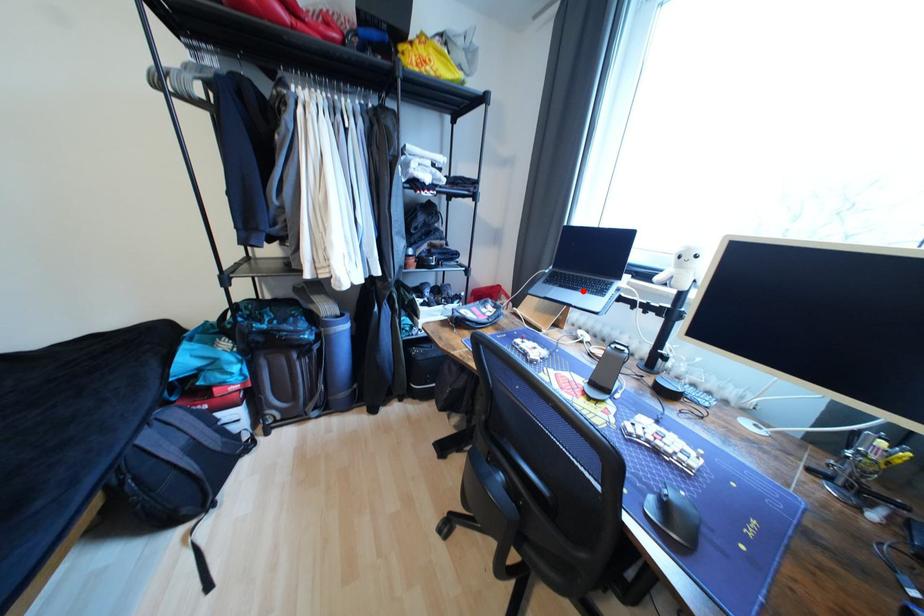
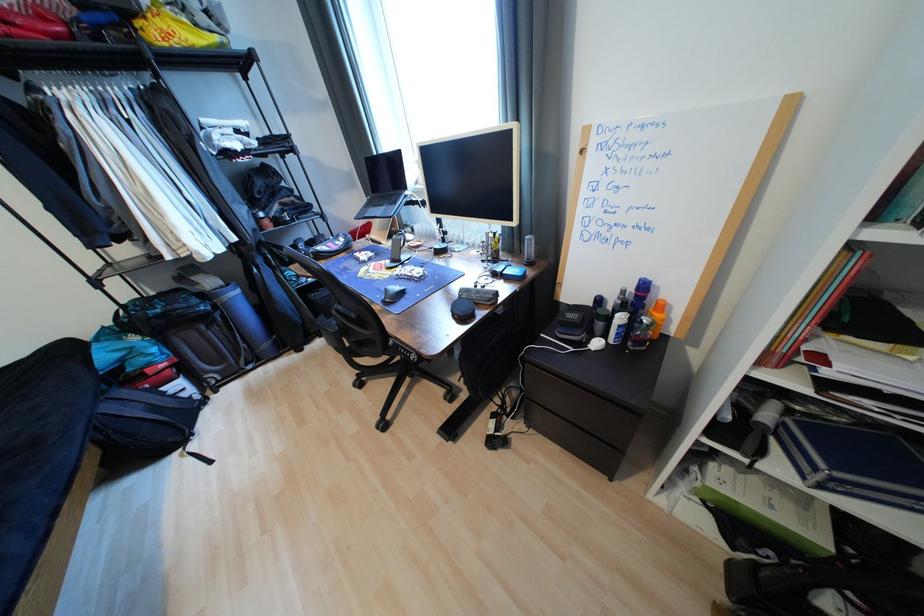
Question: A red point is marked in image1. In image2, is the corresponding 3D point closer to the camera or farther? Reply with the corresponding letter.

Choices:
 (A) The corresponding 3D point is closer.
 (B) The corresponding 3D point is farther.

Answer: (A)